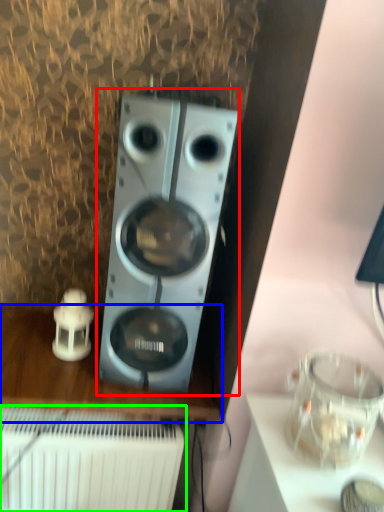
Question: Which is nearer to the home appliance (highlighted by a red box)? furniture (highlighted by a blue box) or radiator (highlighted by a green box).

Choices:
 (A) furniture
 (B) radiator

Answer: (A)